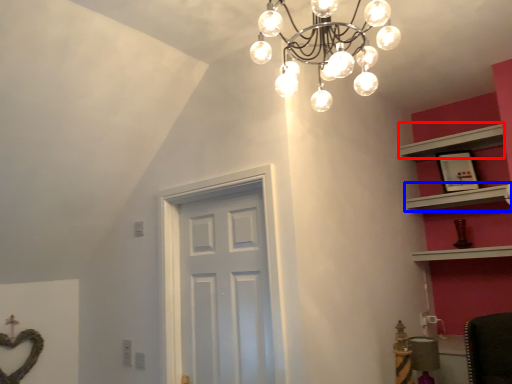
Question: Which of the following is the farthest to the observer, shelf (highlighted by a red box) or shelf (highlighted by a blue box)?

Choices:
 (A) shelf
 (B) shelf

Answer: (A)